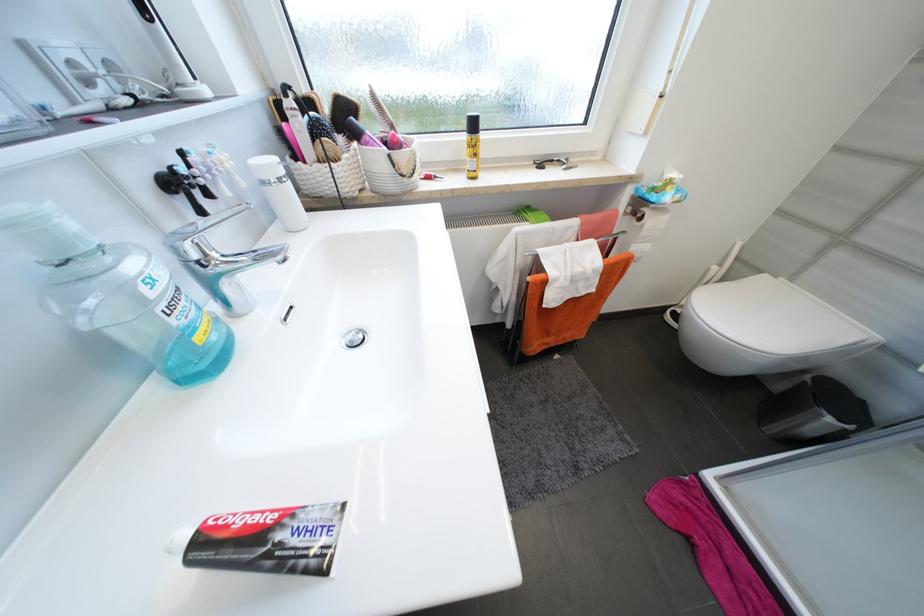
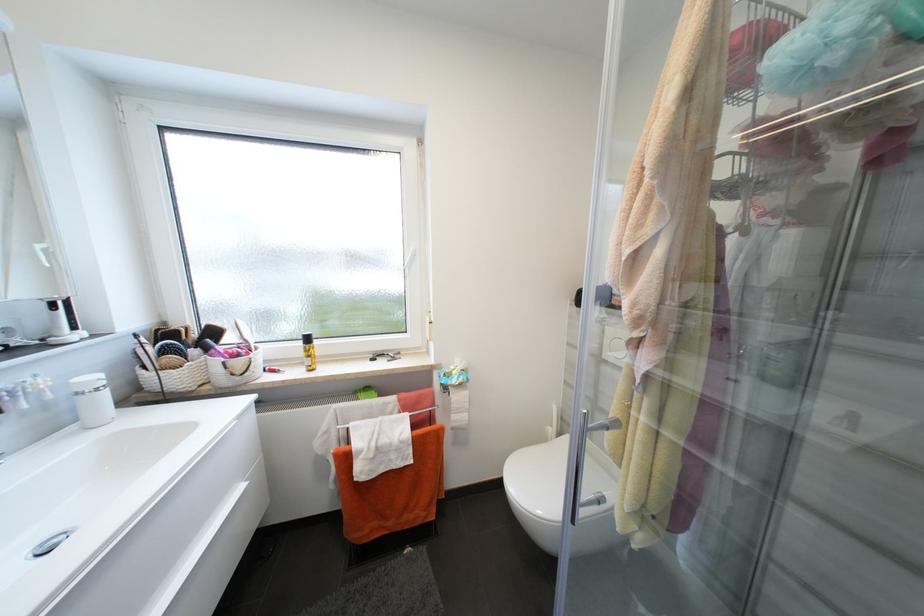
Question: Based on the continuous images, in which direction is the camera rotating? Reply with the corresponding letter.

Choices:
 (A) Left
 (B) Right
 (C) Up
 (D) Down

Answer: (C)